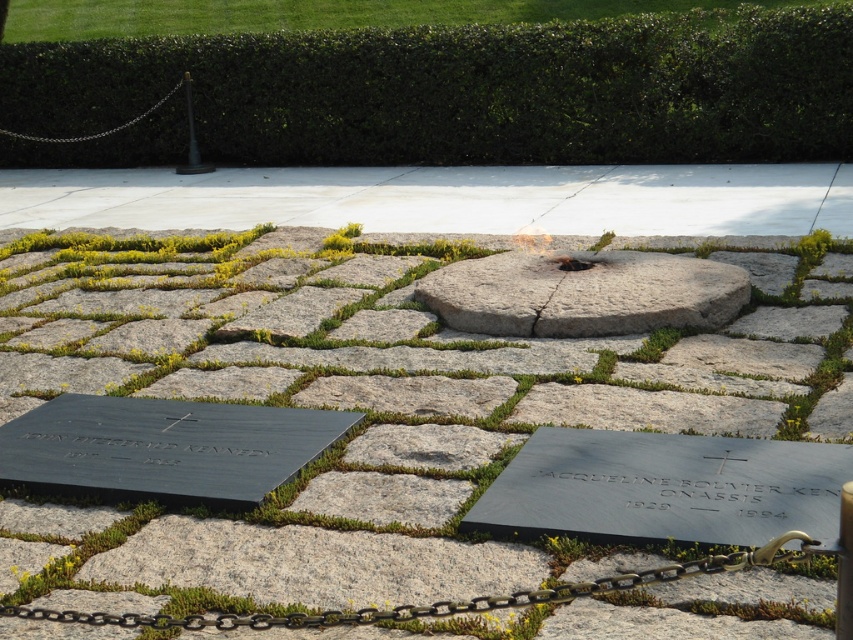
Question: Does gray/granite stone at center appear over silver metallic chain at upper left?

Choices:
 (A) yes
 (B) no

Answer: (B)

Question: Estimate the real-world distances between objects in this image. Which object is closer to the black metal chain at lower center?

Choices:
 (A) gray/granite stone at center
 (B) black granite stone at center
 (C) green leafy hedge at upper center

Answer: (B)

Question: Does green leafy hedge at upper center appear over gray/granite stone at center?

Choices:
 (A) yes
 (B) no

Answer: (A)

Question: Among these objects, which one is farthest from the camera?

Choices:
 (A) silver metallic chain at upper left
 (B) black granite stone at center

Answer: (A)

Question: Which of the following is the farthest from the observer?

Choices:
 (A) gray/granite stone at center
 (B) green leafy hedge at upper center
 (C) black metal chain at lower center
 (D) black granite stone at center

Answer: (B)

Question: Does green leafy hedge at upper center have a larger size compared to gray/granite stone at center?

Choices:
 (A) no
 (B) yes

Answer: (A)